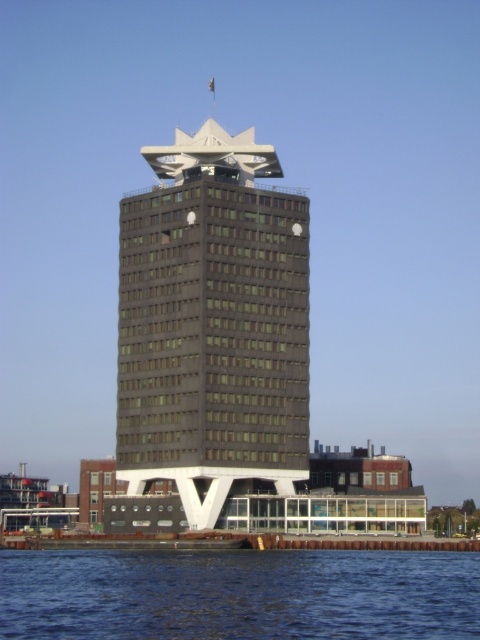
Question: Can you confirm if dark gray concrete tower at center is positioned to the left of blue water at lower left?

Choices:
 (A) yes
 (B) no

Answer: (A)

Question: Which object appears closest to the camera in this image?

Choices:
 (A) dark gray concrete tower at center
 (B) blue water at lower left

Answer: (B)

Question: Is dark gray concrete tower at center smaller than blue water at lower left?

Choices:
 (A) no
 (B) yes

Answer: (A)

Question: Which point is closer to the camera?

Choices:
 (A) (216, 637)
 (B) (193, 186)

Answer: (A)

Question: Is dark gray concrete tower at center to the left of blue water at lower left from the viewer's perspective?

Choices:
 (A) yes
 (B) no

Answer: (A)